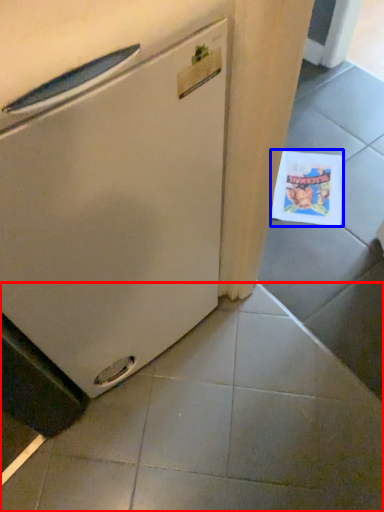
Question: Which of the following is the farthest to the observer, tile (highlighted by a red box) or postcard (highlighted by a blue box)?

Choices:
 (A) tile
 (B) postcard

Answer: (B)